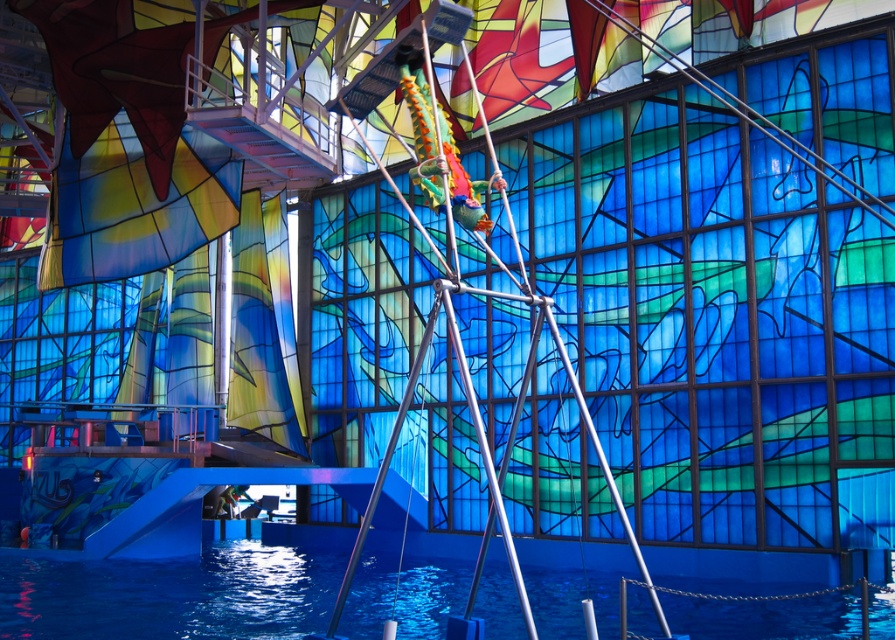
Question: Can you confirm if blue smooth pool at lower center is bigger than metallic silver mast at center?

Choices:
 (A) yes
 (B) no

Answer: (B)

Question: Observing the image, what is the correct spatial positioning of blue smooth pool at lower center in reference to metallic silver mast at center?

Choices:
 (A) left
 (B) right

Answer: (A)

Question: Which of the following is the farthest from the observer?

Choices:
 (A) (211, 604)
 (B) (455, 216)

Answer: (A)

Question: Which of the following is the farthest from the observer?

Choices:
 (A) (295, 625)
 (B) (606, 477)

Answer: (A)

Question: Among these points, which one is nearest to the camera?

Choices:
 (A) (708, 616)
 (B) (506, 204)

Answer: (B)

Question: Is blue smooth pool at lower center below metallic silver mast at center?

Choices:
 (A) yes
 (B) no

Answer: (A)